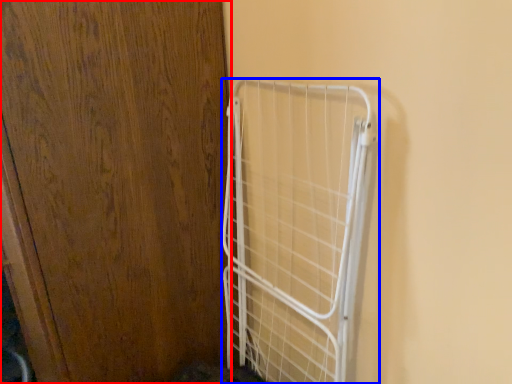
Question: Which object is closer to the camera taking this photo, door (highlighted by a red box) or cage (highlighted by a blue box)?

Choices:
 (A) door
 (B) cage

Answer: (A)